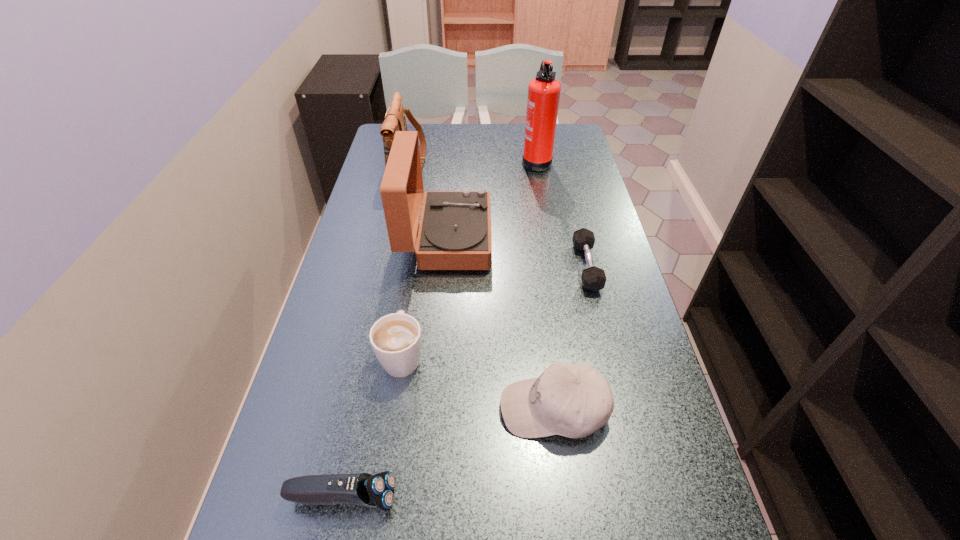
The height and width of the screenshot is (540, 960). What are the coordinates of `vacant space located at the nozzle of the tallest object` in the screenshot? It's located at (409, 160).

Locate an element on the screen. The height and width of the screenshot is (540, 960). free space located 0.230m at the nozzle of the tallest object is located at coordinates (457, 160).

Find the location of a particular element. This screenshot has width=960, height=540. free location located on the face of the second tallest object is located at coordinates click(607, 239).

The width and height of the screenshot is (960, 540). I want to click on vacant space positioned 0.060m on the front-facing side of the third tallest object, so click(x=443, y=160).

What are the coordinates of `vacant point located on the front-facing side of the baseball cap` in the screenshot? It's located at (470, 408).

The height and width of the screenshot is (540, 960). In order to click on vacant region located 0.070m on the front-facing side of the baseball cap in this screenshot , I will do `click(466, 408)`.

This screenshot has height=540, width=960. I want to click on vacant space located 0.330m on the front-facing side of the baseball cap, so click(x=336, y=408).

Locate an element on the screen. Image resolution: width=960 pixels, height=540 pixels. vacant space located 0.300m with the handle on the side of the cappuccino is located at coordinates (419, 247).

Locate an element on the screen. free space located 0.270m with the handle on the side of the cappuccino is located at coordinates (418, 254).

The width and height of the screenshot is (960, 540). In order to click on vacant point located 0.260m with the handle on the side of the cappuccino in this screenshot , I will do `click(418, 256)`.